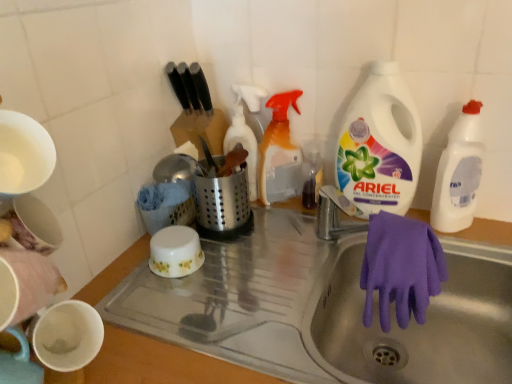
This screenshot has height=384, width=512. Identify the location of free space in front of translucent plastic spray bottle at center, acting as the 3th cleaning product starting from the right. (302, 254).